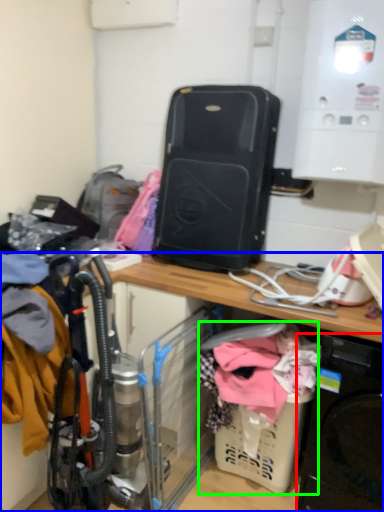
Question: Considering the real-world distances, which object is farthest from washing machine (highlighted by a red box)? desk (highlighted by a blue box) or baby carriage (highlighted by a green box)?

Choices:
 (A) desk
 (B) baby carriage

Answer: (A)